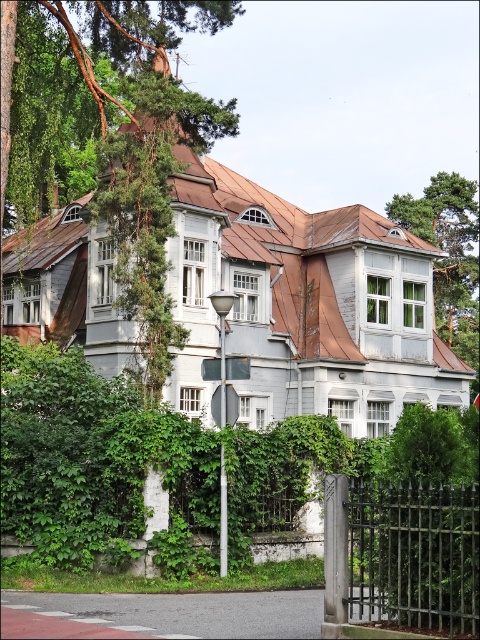
Is green leafy tree at left above black wrought iron gate at center?

Correct, green leafy tree at left is located above black wrought iron gate at center.

Who is more distant from viewer, (1, 17) or (377, 592)?

Positioned behind is point (1, 17).

Locate an element on the screen. This screenshot has height=640, width=480. green leafy tree at left is located at coordinates (139, 140).

Can you confirm if green leafy tree at left is positioned to the right of green leafy tree at upper right?

In fact, green leafy tree at left is to the left of green leafy tree at upper right.

Does point (153, 10) come in front of point (451, 188)?

Yes, point (153, 10) is closer to viewer.

Where is `green leafy tree at left`? Image resolution: width=480 pixels, height=640 pixels. green leafy tree at left is located at coordinates (139, 140).

Who is shorter, black wrought iron gate at center or metallic pole at center?

black wrought iron gate at center

Who is lower down, black wrought iron gate at center or metallic pole at center?

black wrought iron gate at center is lower down.

Find the location of a particular element. The image size is (480, 640). black wrought iron gate at center is located at coordinates (414, 556).